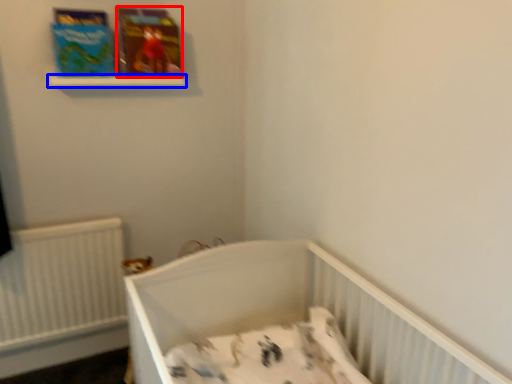
Question: Which of the following is the closest to the observer, paperback book (highlighted by a red box) or balustrade (highlighted by a blue box)?

Choices:
 (A) paperback book
 (B) balustrade

Answer: (B)